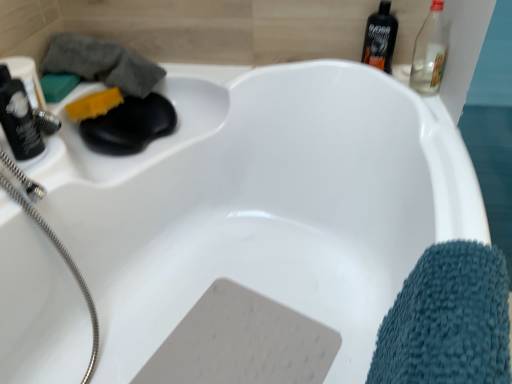
Measure the distance between clear glass bottle at upper right, acting as the 1th bottle starting from the back, and camera.

The distance of clear glass bottle at upper right, acting as the 1th bottle starting from the back, from camera is 1.11 meters.

Image resolution: width=512 pixels, height=384 pixels. What do you see at coordinates (102, 63) in the screenshot?
I see `gray terry cloth towel at upper left, the 1th bath towel positioned from the top` at bounding box center [102, 63].

Describe the element at coordinates (18, 118) in the screenshot. The width and height of the screenshot is (512, 384). I see `matte black shaver at left, acting as the first bottle starting from the left` at that location.

The image size is (512, 384). Describe the element at coordinates (66, 263) in the screenshot. I see `metallic silver garden hose at upper left` at that location.

This screenshot has width=512, height=384. Describe the element at coordinates (448, 320) in the screenshot. I see `teal microfiber towel at lower right, which is the second bath towel from top to bottom` at that location.

In order to face teal microfiber towel at lower right, which is the first bath towel in right-to-left order, should I rotate leftwards or rightwards?

To align with it, rotate right about 24.280°.

Locate an element on the screen. The image size is (512, 384). clear glass bottle at upper right, acting as the 1th bottle starting from the back is located at coordinates (429, 53).

Is green matte soap at upper left, which ranks as the 1th soap in left-to-right order, not inside teal microfiber towel at lower right, which is the first bath towel in right-to-left order?

That's correct, green matte soap at upper left, which ranks as the 1th soap in left-to-right order, is outside of teal microfiber towel at lower right, which is the first bath towel in right-to-left order.

Does green matte soap at upper left, which ranks as the 1th soap in left-to-right order, have a lesser width compared to teal microfiber towel at lower right, acting as the first bath towel starting from the front?

Yes, green matte soap at upper left, which ranks as the 1th soap in left-to-right order, is thinner than teal microfiber towel at lower right, acting as the first bath towel starting from the front.

Relative to gray terry cloth towel at upper left, which is counted as the second bath towel, starting from the bottom, is teal microfiber towel at lower right, which is the first bath towel in right-to-left order, in front or behind?

Visually, teal microfiber towel at lower right, which is the first bath towel in right-to-left order, is located in front of gray terry cloth towel at upper left, which is counted as the second bath towel, starting from the bottom.

Between teal microfiber towel at lower right, acting as the first bath towel starting from the front, and gray terry cloth towel at upper left, positioned as the 2th bath towel in right-to-left order, which one has smaller width?

teal microfiber towel at lower right, acting as the first bath towel starting from the front.

Are teal microfiber towel at lower right, acting as the first bath towel starting from the front, and gray terry cloth towel at upper left, the 1th bath towel positioned from the top, far apart?

teal microfiber towel at lower right, acting as the first bath towel starting from the front, is actually quite close to gray terry cloth towel at upper left, the 1th bath towel positioned from the top.

Is clear glass bottle at upper right, acting as the 1th bottle starting from the back, bigger than green matte soap at upper left, the 2th soap from the right?

Indeed, clear glass bottle at upper right, acting as the 1th bottle starting from the back, has a larger size compared to green matte soap at upper left, the 2th soap from the right.

Can you confirm if clear glass bottle at upper right, which is the 2th bottle in bottom-to-top order, is thinner than green matte soap at upper left, which ranks as the 1th soap in left-to-right order?

Yes.

From their relative heights in the image, would you say clear glass bottle at upper right, acting as the 1th bottle starting from the back, is taller or shorter than green matte soap at upper left, the 2th soap from the right?

Clearly, clear glass bottle at upper right, acting as the 1th bottle starting from the back, is taller compared to green matte soap at upper left, the 2th soap from the right.

Can you confirm if yellow sponge at upper left, the first soap from the right, is shorter than teal microfiber towel at lower right, acting as the first bath towel starting from the front?

Yes.

From a real-world perspective, is yellow sponge at upper left, which ranks as the second soap in left-to-right order, on top of teal microfiber towel at lower right, marked as the second bath towel in a back-to-front arrangement?

Yes, from a real-world perspective, yellow sponge at upper left, which ranks as the second soap in left-to-right order, is above teal microfiber towel at lower right, marked as the second bath towel in a back-to-front arrangement.

In the scene shown: Does yellow sponge at upper left, which ranks as the second soap in left-to-right order, have a larger size compared to teal microfiber towel at lower right, marked as the second bath towel in a back-to-front arrangement?

No.

How many degrees apart are the facing directions of green matte soap at upper left, which ranks as the 1th soap in left-to-right order, and clear glass bottle at upper right, acting as the 1th bottle starting from the back?

green matte soap at upper left, which ranks as the 1th soap in left-to-right order, and clear glass bottle at upper right, acting as the 1th bottle starting from the back, are facing 90 degrees away from each other.

Would you say green matte soap at upper left, the 2th soap from the right, is outside clear glass bottle at upper right, which is the 2th bottle in bottom-to-top order?

That's correct, green matte soap at upper left, the 2th soap from the right, is outside of clear glass bottle at upper right, which is the 2th bottle in bottom-to-top order.

From the image's perspective, does green matte soap at upper left, which ranks as the 1th soap in left-to-right order, appear higher than clear glass bottle at upper right, which is counted as the 2th bottle, starting from the left?

No, from the image's perspective, green matte soap at upper left, which ranks as the 1th soap in left-to-right order, is not on top of clear glass bottle at upper right, which is counted as the 2th bottle, starting from the left.

Between green matte soap at upper left, which ranks as the 1th soap in left-to-right order, and clear glass bottle at upper right, which is the 1th bottle from top to bottom, which one has smaller size?

green matte soap at upper left, which ranks as the 1th soap in left-to-right order, is smaller.

Is yellow sponge at upper left, which ranks as the second soap in left-to-right order, directly adjacent to matte black shaver at left, which is the 2th bottle in right-to-left order?

No, yellow sponge at upper left, which ranks as the second soap in left-to-right order, is not making contact with matte black shaver at left, which is the 2th bottle in right-to-left order.

Considering the relative sizes of yellow sponge at upper left, which ranks as the second soap in left-to-right order, and matte black shaver at left, the second bottle from the back, in the image provided, is yellow sponge at upper left, which ranks as the second soap in left-to-right order, wider than matte black shaver at left, the second bottle from the back,?

Yes, yellow sponge at upper left, which ranks as the second soap in left-to-right order, is wider than matte black shaver at left, the second bottle from the back.

Between point (98, 113) and point (17, 102), which one is positioned in front?

The point (17, 102) is closer.

Can you confirm if black plastic bottle at upper right is positioned to the right of metallic silver garden hose at upper left?

Yes, black plastic bottle at upper right is to the right of metallic silver garden hose at upper left.

Is black plastic bottle at upper right positioned with its back to metallic silver garden hose at upper left?

No, black plastic bottle at upper right is not facing away from metallic silver garden hose at upper left.

Is black plastic bottle at upper right next to metallic silver garden hose at upper left and touching it?

There is a gap between black plastic bottle at upper right and metallic silver garden hose at upper left.

Is point (377, 63) closer or farther from the camera than point (59, 243)?

Point (377, 63) appears to be farther away from the viewer than point (59, 243).

There is a teal microfiber towel at lower right, arranged as the second bath towel when viewed from the left. Identify the location of the 2nd soap above it (from a real-world perspective). (58, 85).

The width and height of the screenshot is (512, 384). I want to click on bath towel lying on the left of teal microfiber towel at lower right, which is the second bath towel from top to bottom, so click(102, 63).

When comparing their distances from matte black shaver at left, acting as the 2th bottle starting from the top, does teal microfiber towel at lower right, marked as the second bath towel in a back-to-front arrangement, or gray terry cloth towel at upper left, positioned as the 2th bath towel in right-to-left order, seem further?

Among the two, teal microfiber towel at lower right, marked as the second bath towel in a back-to-front arrangement, is located further to matte black shaver at left, acting as the 2th bottle starting from the top.

Based on their spatial positions, is teal microfiber towel at lower right, arranged as the second bath towel when viewed from the left, or black plastic bottle at upper right further from matte black shaver at left, acting as the 2th bottle starting from the top?

Among the two, black plastic bottle at upper right is located further to matte black shaver at left, acting as the 2th bottle starting from the top.

Which object lies further to the anchor point clear glass bottle at upper right, arranged as the 1th bottle when viewed from the right, black plastic bottle at upper right or gray terry cloth towel at upper left, placed as the 1th bath towel when sorted from left to right?

gray terry cloth towel at upper left, placed as the 1th bath towel when sorted from left to right, lies further to clear glass bottle at upper right, arranged as the 1th bottle when viewed from the right, than the other object.

Considering their positions, is yellow sponge at upper left, which ranks as the second soap in left-to-right order, positioned closer to black plastic bottle at upper right than green matte soap at upper left, which ranks as the 1th soap in left-to-right order?

The object closer to black plastic bottle at upper right is yellow sponge at upper left, which ranks as the second soap in left-to-right order.

From the image, which object appears to be farther from green matte soap at upper left, which ranks as the 1th soap in left-to-right order, matte black shaver at left, the second bottle from the back, or black plastic bottle at upper right?

Among the two, black plastic bottle at upper right is located further to green matte soap at upper left, which ranks as the 1th soap in left-to-right order.

Which object lies further to the anchor point gray terry cloth towel at upper left, arranged as the 1th bath towel when viewed from the back, clear glass bottle at upper right, arranged as the 1th bottle when viewed from the right, or black plastic bottle at upper right?

The object further to gray terry cloth towel at upper left, arranged as the 1th bath towel when viewed from the back, is clear glass bottle at upper right, arranged as the 1th bottle when viewed from the right.

Looking at the image, which one is located closer to clear glass bottle at upper right, which is the 1th bottle from top to bottom, green matte soap at upper left, which ranks as the 1th soap in left-to-right order, or yellow sponge at upper left, the first soap from the right?

yellow sponge at upper left, the first soap from the right, is closer to clear glass bottle at upper right, which is the 1th bottle from top to bottom.

Which object lies nearer to the anchor point clear glass bottle at upper right, which is counted as the 2th bottle, starting from the left, black plastic bottle at upper right or metallic silver garden hose at upper left?

black plastic bottle at upper right is closer to clear glass bottle at upper right, which is counted as the 2th bottle, starting from the left.

Where is `bath towel between metallic silver garden hose at upper left and green matte soap at upper left, which ranks as the 1th soap in left-to-right order, along the z-axis`? The height and width of the screenshot is (384, 512). bath towel between metallic silver garden hose at upper left and green matte soap at upper left, which ranks as the 1th soap in left-to-right order, along the z-axis is located at coordinates (102, 63).

Identify the location of mouthwash located between matte black shaver at left, which is the 2th bottle in right-to-left order, and clear glass bottle at upper right, acting as the 1th bottle starting from the back, in the left-right direction. (380, 38).

Where is `bath towel between green matte soap at upper left, the 2th soap from the right, and teal microfiber towel at lower right, marked as the second bath towel in a back-to-front arrangement`? The image size is (512, 384). bath towel between green matte soap at upper left, the 2th soap from the right, and teal microfiber towel at lower right, marked as the second bath towel in a back-to-front arrangement is located at coordinates (x=102, y=63).

Where is `garden hose between green matte soap at upper left, the 2th soap from the right, and clear glass bottle at upper right, which appears as the 2th bottle when viewed from the front, in the horizontal direction`? The width and height of the screenshot is (512, 384). garden hose between green matte soap at upper left, the 2th soap from the right, and clear glass bottle at upper right, which appears as the 2th bottle when viewed from the front, in the horizontal direction is located at coordinates (66, 263).